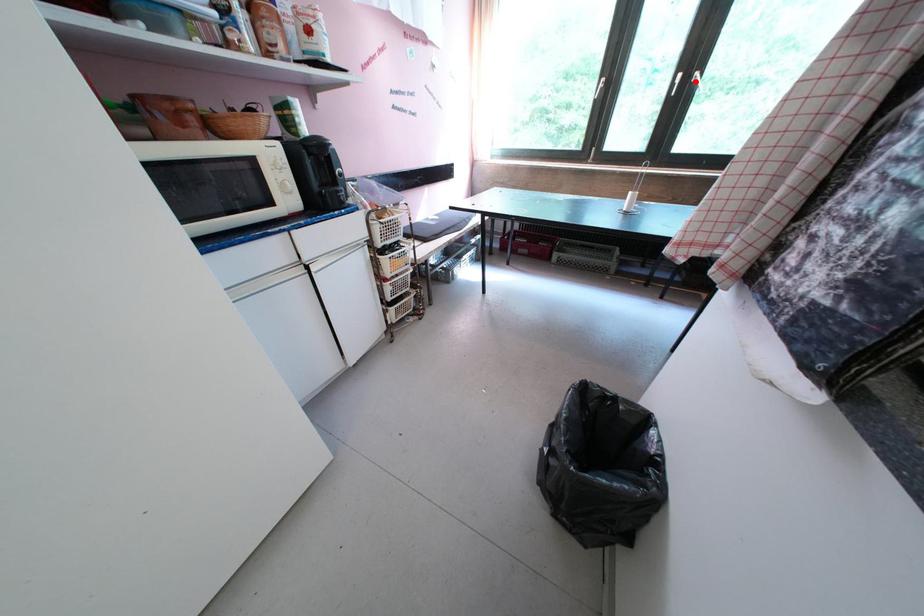
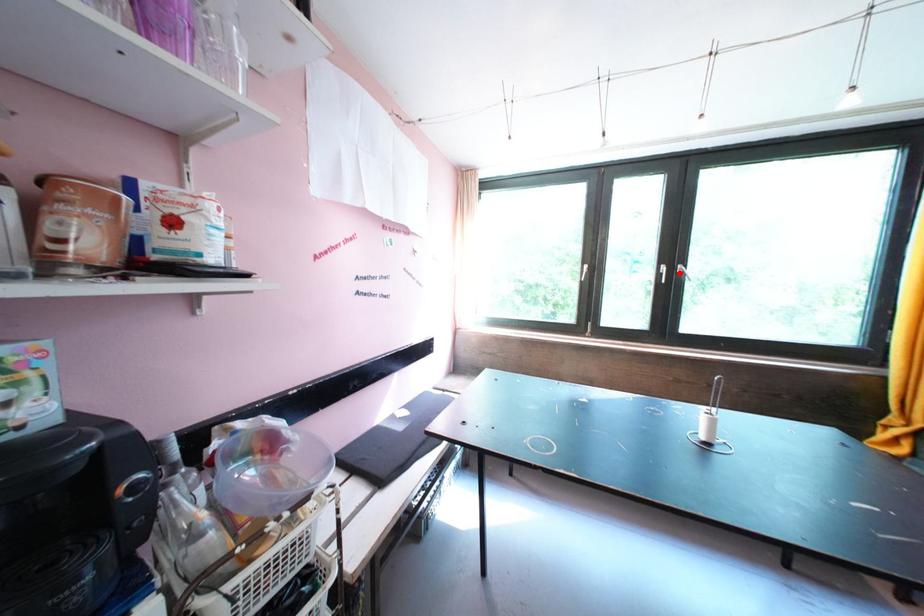
I am providing you with two images of the same scene from different viewpoints. A red point is marked on the first image and another point is marked on the second image. Is the red point in image1 aligned with the point shown in image2?

Yes